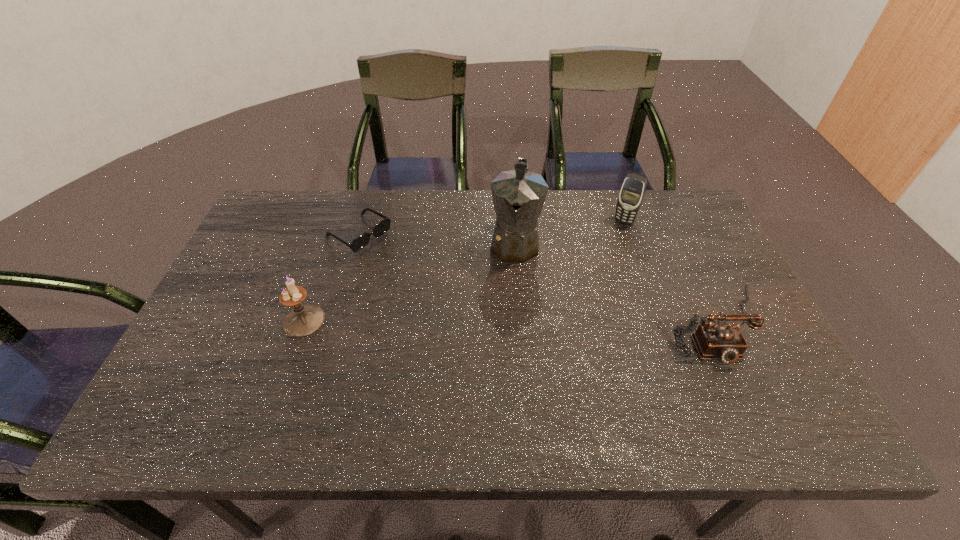
The width and height of the screenshot is (960, 540). Find the location of `object that is positioned at the near edge`. object that is positioned at the near edge is located at coordinates (725, 342).

Find the location of a particular element. object at the right edge is located at coordinates (725, 342).

The image size is (960, 540). I want to click on object that is at the near right corner, so click(725, 342).

In order to click on vacant space at the far edge of the desktop in this screenshot , I will do click(342, 220).

You are a GUI agent. You are given a task and a screenshot of the screen. Output one action in this format:
    pyautogui.click(x=<x>, y=<y>)
    Task: Click on the free space at the near edge
    The height and width of the screenshot is (540, 960).
    Given the screenshot: What is the action you would take?
    pyautogui.click(x=504, y=392)

This screenshot has width=960, height=540. Identify the location of free space at the left edge of the desktop. (238, 340).

Identify the location of vacant region at the right edge. Image resolution: width=960 pixels, height=540 pixels. (709, 258).

In the image, there is a desktop. At what (x,y) coordinates should I click in order to perform the action: click on free space at the far right corner. Please return your answer as a coordinate pair (x, y). The width and height of the screenshot is (960, 540). Looking at the image, I should click on (679, 211).

Find the location of `free point between the telephone and the candle holder`. free point between the telephone and the candle holder is located at coordinates (510, 322).

Identify the location of vacant region between the candle holder and the fourth tallest object. The height and width of the screenshot is (540, 960). (510, 322).